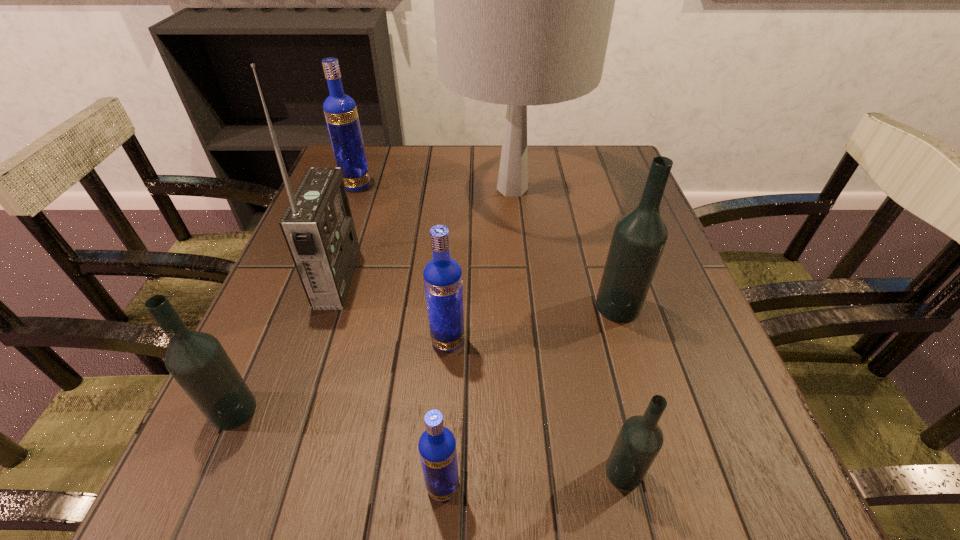
Identify which blue vodka is the second closest to the smallest blue vodka. Please provide its 2D coordinates. Your answer should be formatted as a tuple, i.e. [(x, y)], where the tuple contains the x and y coordinates of a point satisfying the conditions above.

[(340, 110)]

Where is `black vodka that stands as the third closest to the farthest vodka`? This screenshot has height=540, width=960. black vodka that stands as the third closest to the farthest vodka is located at coordinates pos(640,439).

Where is `black vodka object that ranks as the second closest to the second farthest black vodka`? The width and height of the screenshot is (960, 540). black vodka object that ranks as the second closest to the second farthest black vodka is located at coordinates (639, 237).

This screenshot has height=540, width=960. I want to click on free location that satisfies the following two spatial constraints: 1. on the display of the radio receiver; 2. on the back side of the smallest black vodka, so click(x=273, y=472).

Locate an element on the screen. The height and width of the screenshot is (540, 960). vacant area that satisfies the following two spatial constraints: 1. on the front-facing side of the brown lampshade; 2. on the front side of the second biggest black vodka is located at coordinates (534, 410).

Where is `vacant area in the image that satisfies the following two spatial constraints: 1. on the back side of the fourth farthest vodka; 2. on the right side of the biggest blue vodka`? The image size is (960, 540). vacant area in the image that satisfies the following two spatial constraints: 1. on the back side of the fourth farthest vodka; 2. on the right side of the biggest blue vodka is located at coordinates 333,185.